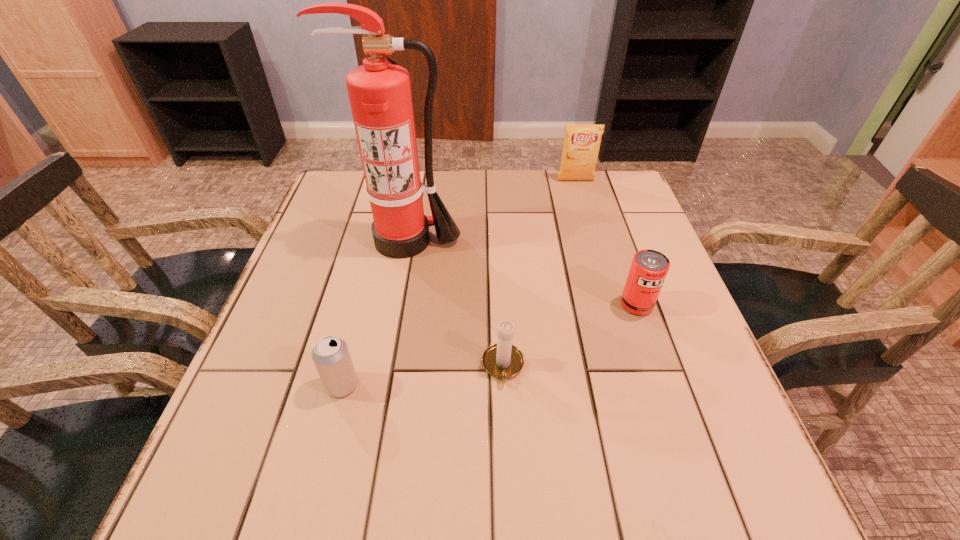
Identify the location of free location at the left edge. (341, 246).

Where is `free space at the right edge of the desktop`? The image size is (960, 540). free space at the right edge of the desktop is located at coordinates (665, 414).

The height and width of the screenshot is (540, 960). I want to click on vacant area at the far right corner of the desktop, so click(630, 196).

Identify the location of vacant area between the candle holder and the fourth shortest object. (540, 273).

The width and height of the screenshot is (960, 540). Find the location of `vacant area that lies between the tallest object and the farthest object`. vacant area that lies between the tallest object and the farthest object is located at coordinates (492, 211).

Where is `vacant area between the tallest object and the candle holder`? vacant area between the tallest object and the candle holder is located at coordinates (455, 303).

The height and width of the screenshot is (540, 960). Find the location of `free space that is in between the candle holder and the third nearest object`. free space that is in between the candle holder and the third nearest object is located at coordinates [570, 335].

This screenshot has height=540, width=960. I want to click on empty location between the beer can and the candle holder, so click(x=422, y=375).

Locate an element on the screen. This screenshot has width=960, height=540. vacant space that's between the third farthest object and the farthest object is located at coordinates (606, 242).

You are a GUI agent. You are given a task and a screenshot of the screen. Output one action in this format:
    pyautogui.click(x=<x>, y=<y>)
    Task: Click on the vacant space that's between the fire extinguisher and the third nearest object
    The image size is (960, 540).
    Given the screenshot: What is the action you would take?
    pyautogui.click(x=521, y=273)